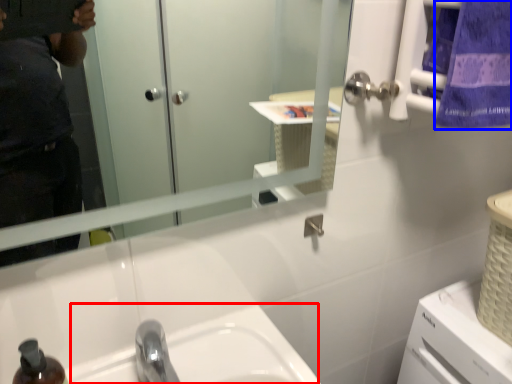
Question: Which of the following is the farthest to the observer, sink (highlighted by a red box) or towel/napkin (highlighted by a blue box)?

Choices:
 (A) sink
 (B) towel/napkin

Answer: (B)